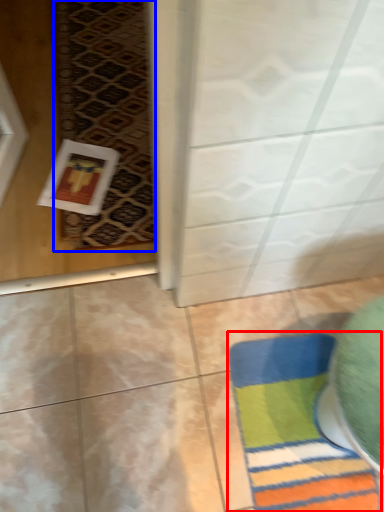
Question: Among these objects, which one is farthest to the camera, bath mat (highlighted by a red box) or mat (highlighted by a blue box)?

Choices:
 (A) bath mat
 (B) mat

Answer: (B)